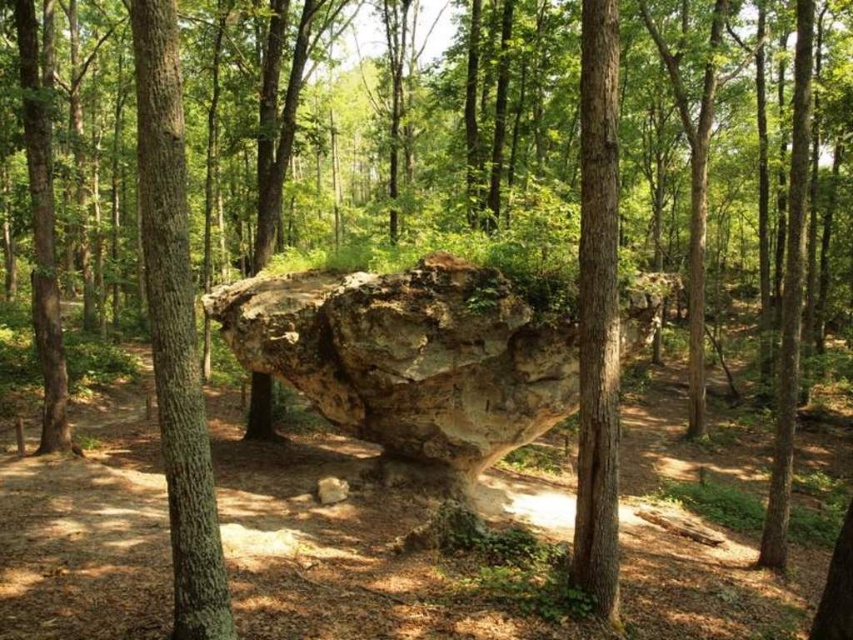
You are standing in a forest and see a point marked at coordinates (387, 438). If you want to place a 10 feet long bench here, will it fit without overlapping the large weathered rock formation?

The point at (387, 438) is 36.96 feet away from the viewer. Since the bench is only 10 feet long, there is sufficient space between the point and the rock formation to place the bench without overlapping it.

You are a hiker who has just arrived at the forest clearing. You see the rough textured rock at center. Can you estimate its exact location in the scene?

The rough textured rock at center is located at point (412,356).